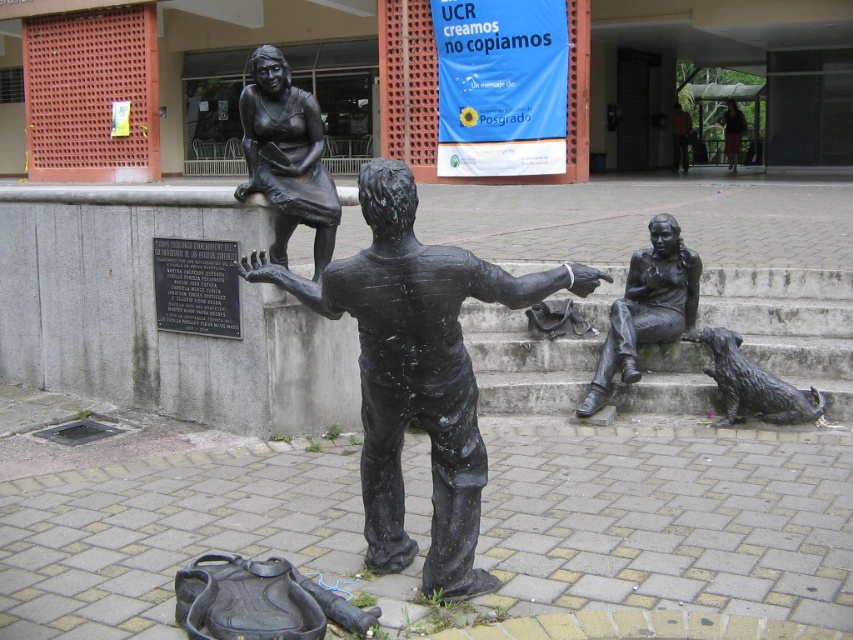
Is point (252, 182) positioned in front of point (811, 410)?

Yes, it is in front of point (811, 410).

Can you confirm if bronze statue of woman at upper left is smaller than shiny bronze dog at lower right?

Yes.

The height and width of the screenshot is (640, 853). I want to click on bronze statue of woman at upper left, so click(x=286, y=156).

At what (x,y) coordinates should I click in order to perform the action: click on bronze statue of woman at upper left. Please return your answer as a coordinate pair (x, y). Looking at the image, I should click on (286, 156).

Does bronze statue of woman at upper left come in front of bronze statue of woman sitting at right?

Yes, it is.

How far apart are bronze statue of woman at upper left and bronze statue of woman sitting at right?

They are 2.26 meters apart.

Where is `bronze statue of woman at upper left`? bronze statue of woman at upper left is located at coordinates (286, 156).

Locate an element on the screen. The height and width of the screenshot is (640, 853). bronze statue of woman at upper left is located at coordinates (286, 156).

Which is more to the right, bronze statue of woman at center or dark brown statue at center?

From the viewer's perspective, bronze statue of woman at center appears more on the right side.

Who is more distant from viewer, (727, 161) or (688, 147)?

Positioned behind is point (727, 161).

This screenshot has width=853, height=640. In order to click on bronze statue of woman at center in this screenshot , I will do `click(732, 132)`.